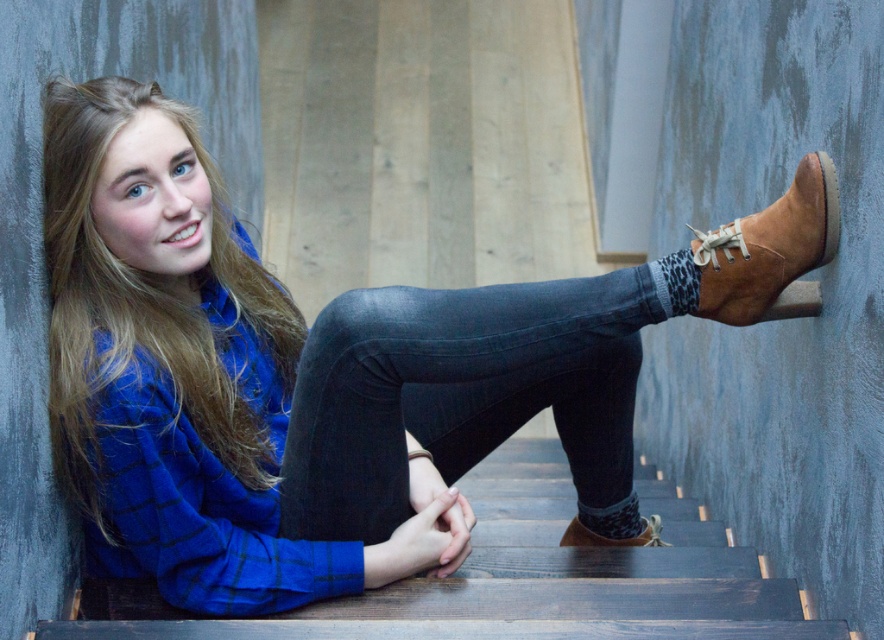
Question: Is dark gray denim jeans at center positioned behind leather boot at lower center?

Choices:
 (A) no
 (B) yes

Answer: (A)

Question: Does dark gray denim jeans at center have a lesser width compared to blonde hair at upper left?

Choices:
 (A) yes
 (B) no

Answer: (B)

Question: Is dark gray denim jeans at center thinner than brown suede boot at upper right?

Choices:
 (A) yes
 (B) no

Answer: (B)

Question: Among these objects, which one is farthest from the camera?

Choices:
 (A) blonde hair at upper left
 (B) dark gray denim jeans at center
 (C) dark wood stairs at center
 (D) leather boot at lower center

Answer: (D)

Question: Which point is farther to the camera?

Choices:
 (A) (517, 330)
 (B) (233, 449)

Answer: (B)

Question: Which is nearer to the brown suede boot at upper right?

Choices:
 (A) blonde hair at upper left
 (B) dark wood stairs at center

Answer: (B)